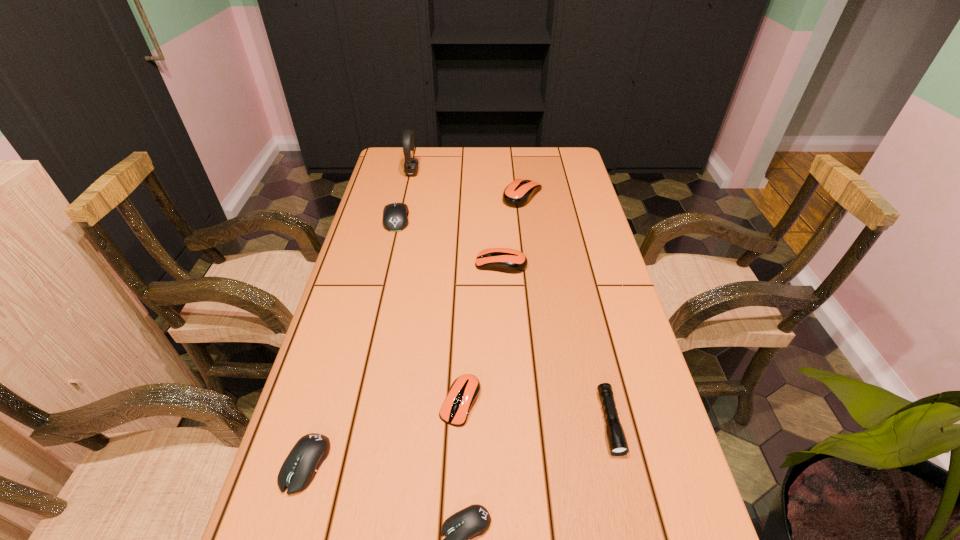
This screenshot has width=960, height=540. I want to click on computer mouse that is at the right edge, so click(x=517, y=194).

You are a GUI agent. You are given a task and a screenshot of the screen. Output one action in this format:
    pyautogui.click(x=<x>, y=<y>)
    Task: Click on the flashlight located at the right edge
    
    Given the screenshot: What is the action you would take?
    pyautogui.click(x=616, y=438)

Image resolution: width=960 pixels, height=540 pixels. Identify the location of object that is at the far left corner. (411, 167).

The height and width of the screenshot is (540, 960). What are the coordinates of `vacant space at the far edge` in the screenshot? It's located at (511, 152).

The width and height of the screenshot is (960, 540). In the image, there is a desktop. Identify the location of blank space at the left edge. (351, 505).

Locate an element on the screen. free location at the right edge of the desktop is located at coordinates pyautogui.click(x=592, y=201).

Identify the location of vacant space at the far left corner of the desktop. (384, 169).

Locate an element on the screen. This screenshot has height=540, width=960. free spot between the headset and the nearest orange computer mouse is located at coordinates (436, 287).

The height and width of the screenshot is (540, 960). I want to click on free space between the third nearest computer equipment and the headset, so click(436, 287).

Locate an element on the screen. The width and height of the screenshot is (960, 540). empty space that is in between the second nearest computer equipment and the smallest orange computer mouse is located at coordinates [383, 433].